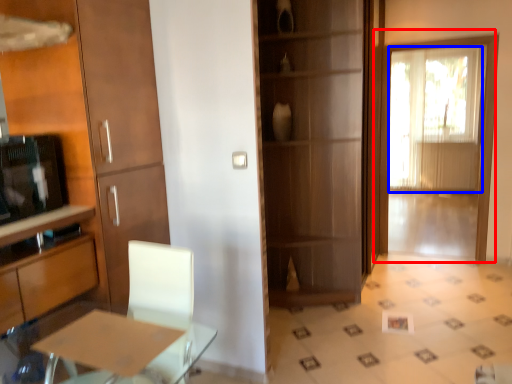
Question: Which object is closer to the camera taking this photo, door (highlighted by a red box) or window screen (highlighted by a blue box)?

Choices:
 (A) door
 (B) window screen

Answer: (A)